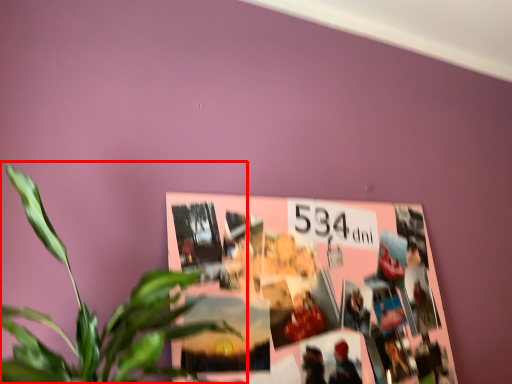
Question: Where is houseplant (annotated by the red box) located in relation to bulletin board in the image?

Choices:
 (A) left
 (B) right

Answer: (A)